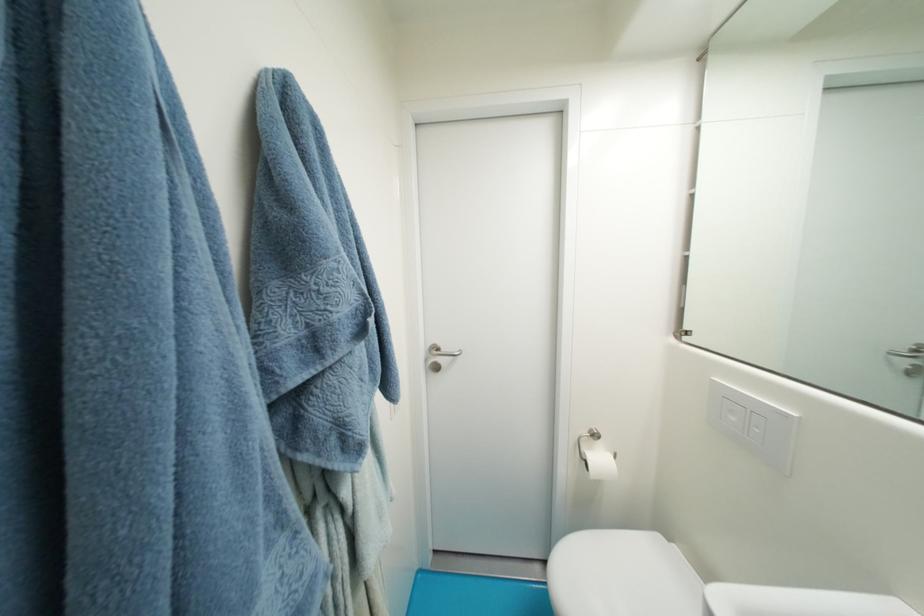
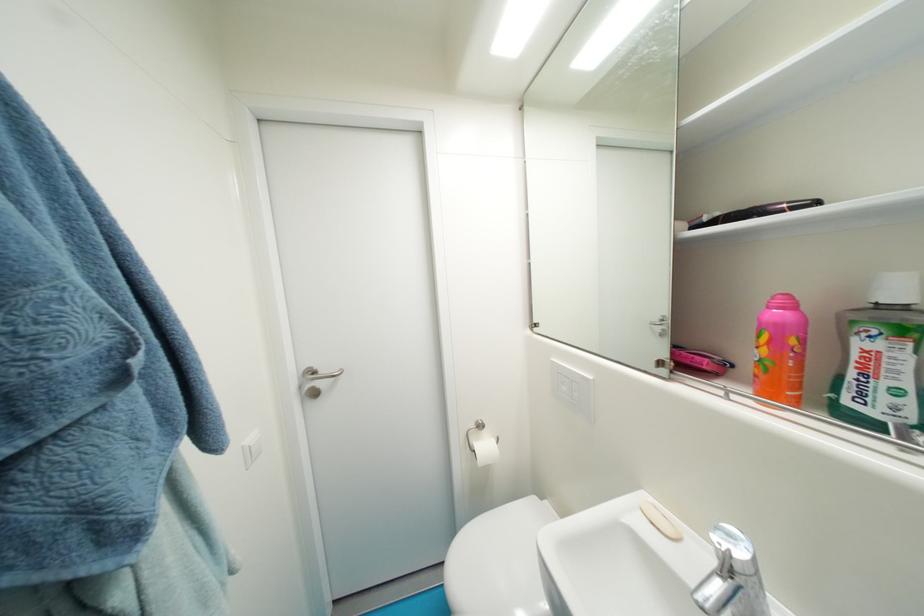
In the second image, find the point that corresponds to (x=606, y=461) in the first image.

(492, 448)